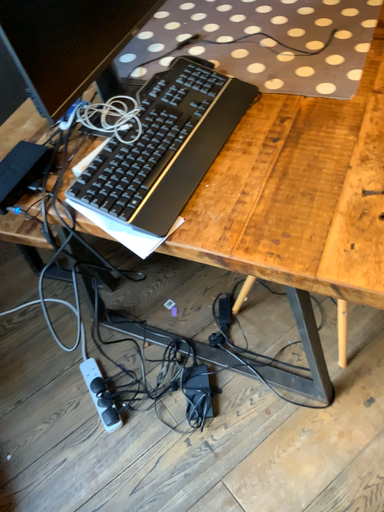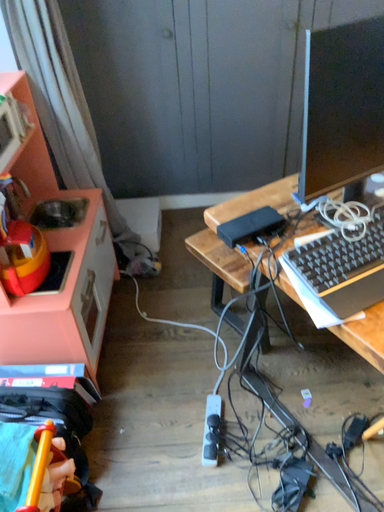
Question: How did the camera likely rotate when shooting the video?

Choices:
 (A) rotated downward
 (B) rotated upward

Answer: (B)